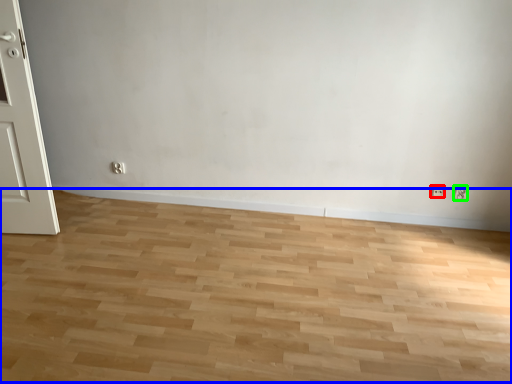
Question: Based on their relative distances, which object is nearer to electric outlet (highlighted by a red box)? Choose from plain (highlighted by a blue box) and electric outlet (highlighted by a green box).

Choices:
 (A) plain
 (B) electric outlet

Answer: (B)